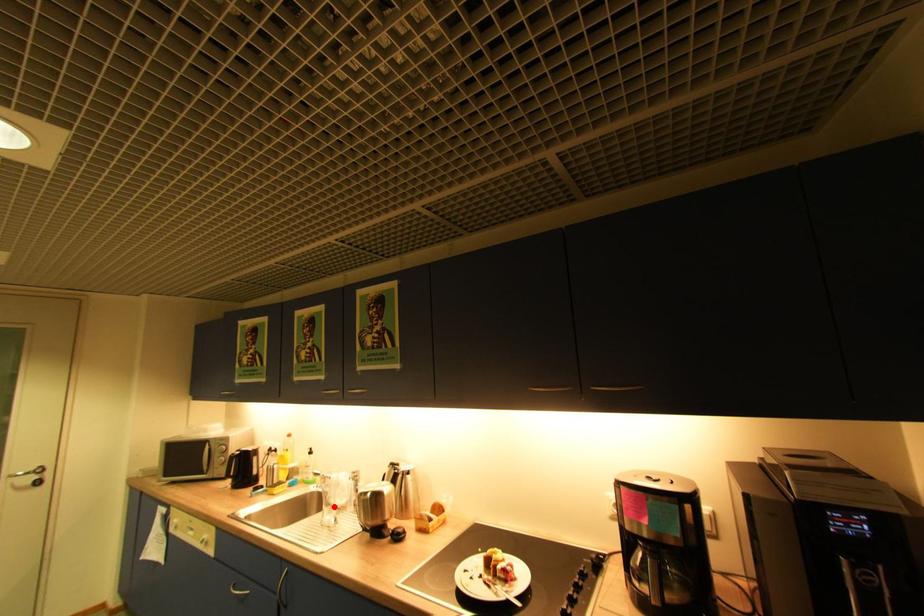
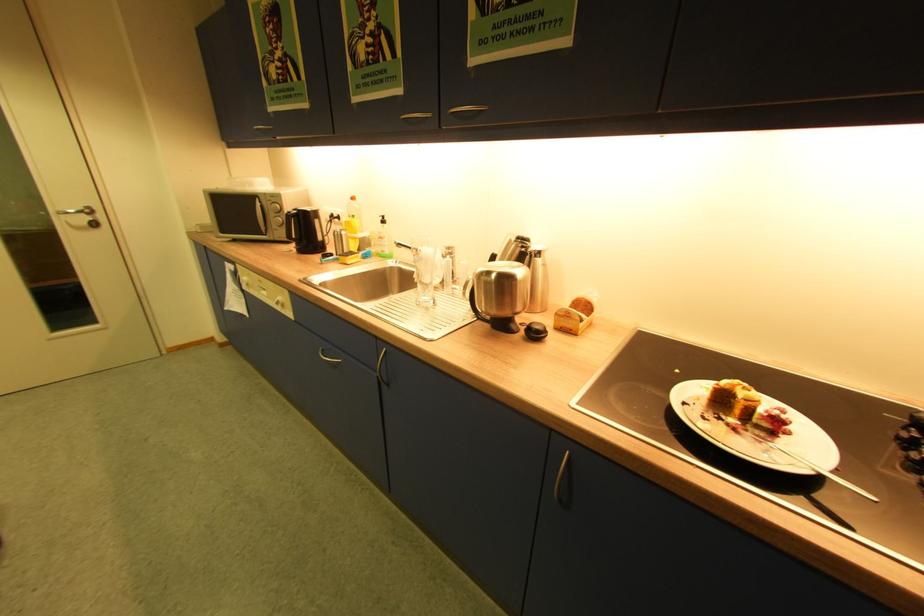
The point at the highlighted location is marked in the first image. Where is the corresponding point in the second image?

(427, 284)